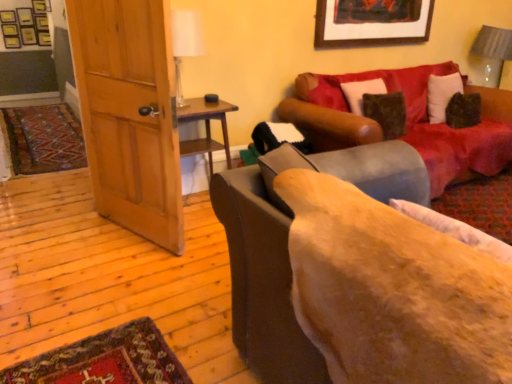
You are a GUI agent. You are given a task and a screenshot of the screen. Output one action in this format:
    pyautogui.click(x=<x>, y=<y>)
    Task: Click on the white glass table lamp at upper center
    
    Given the screenshot: What is the action you would take?
    pyautogui.click(x=185, y=43)

What do you see at coordinates (205, 127) in the screenshot?
I see `wooden side table at left` at bounding box center [205, 127].

Find the location of a particular element. This screenshot has height=384, width=512. wooden door at left is located at coordinates (129, 114).

The height and width of the screenshot is (384, 512). What do you see at coordinates (287, 246) in the screenshot?
I see `velvet brown couch at center, the first studio couch viewed from the front` at bounding box center [287, 246].

Find the location of a particular element. The height and width of the screenshot is (384, 512). wooden picture frame at upper center is located at coordinates tap(372, 22).

Is wooden side table at left aimed at velvet red couch at upper right, which is counted as the second studio couch, starting from the front?

No.

Does point (200, 100) lie behind point (452, 71)?

No, it is in front of (452, 71).

Is wooden side table at left to the right of velvet red couch at upper right, acting as the first studio couch starting from the back, from the viewer's perspective?

No, wooden side table at left is not to the right of velvet red couch at upper right, acting as the first studio couch starting from the back.

Is wooden side table at left far from velvet red couch at upper right, which is counted as the second studio couch, starting from the front?

Actually, wooden side table at left and velvet red couch at upper right, which is counted as the second studio couch, starting from the front, are a little close together.

Could you tell me if white glass table lamp at upper center is turned towards wooden side table at left?

No, white glass table lamp at upper center is not oriented towards wooden side table at left.

Considering the relative sizes of white glass table lamp at upper center and wooden side table at left in the image provided, is white glass table lamp at upper center bigger than wooden side table at left?

No, white glass table lamp at upper center is not bigger than wooden side table at left.

From a real-world perspective, is white glass table lamp at upper center over wooden side table at left?

Yes.

Can you confirm if white glass table lamp at upper center is thinner than wooden side table at left?

Yes, white glass table lamp at upper center is thinner than wooden side table at left.

Is white glass table lamp at upper center in front of velvet red couch at upper right, which is counted as the second studio couch, starting from the front?

Yes, it is in front of velvet red couch at upper right, which is counted as the second studio couch, starting from the front.

Considering the sizes of objects white glass table lamp at upper center and velvet red couch at upper right, which is counted as the second studio couch, starting from the front, in the image provided, who is wider, white glass table lamp at upper center or velvet red couch at upper right, which is counted as the second studio couch, starting from the front,?

With larger width is velvet red couch at upper right, which is counted as the second studio couch, starting from the front.

Looking at this image, considering the sizes of objects white glass table lamp at upper center and velvet red couch at upper right, which is counted as the second studio couch, starting from the front, in the image provided, who is bigger, white glass table lamp at upper center or velvet red couch at upper right, which is counted as the second studio couch, starting from the front,?

Bigger between the two is velvet red couch at upper right, which is counted as the second studio couch, starting from the front.

From a real-world perspective, is velvet red couch at upper right, acting as the first studio couch starting from the back, located higher than fluffy beige pillow at lower right?

No, from a real-world perspective, velvet red couch at upper right, acting as the first studio couch starting from the back, is not on top of fluffy beige pillow at lower right.

Where is `pillow to the left of velvet red couch at upper right, which is counted as the second studio couch, starting from the front`? pillow to the left of velvet red couch at upper right, which is counted as the second studio couch, starting from the front is located at coordinates (455, 229).

Can you tell me how much velvet red couch at upper right, which is counted as the second studio couch, starting from the front, and fluffy beige pillow at lower right differ in facing direction?

There is a 90.3-degree angle between the facing directions of velvet red couch at upper right, which is counted as the second studio couch, starting from the front, and fluffy beige pillow at lower right.

Can you confirm if velvet red couch at upper right, which is counted as the second studio couch, starting from the front, is positioned to the right of fluffy beige pillow at lower right?

Correct, you'll find velvet red couch at upper right, which is counted as the second studio couch, starting from the front, to the right of fluffy beige pillow at lower right.

Considering the sizes of objects wooden picture frame at upper center and gray fabric lampshade at upper right in the image provided, who is wider, wooden picture frame at upper center or gray fabric lampshade at upper right?

gray fabric lampshade at upper right.

From a real-world perspective, which object stands above the other?

wooden picture frame at upper center is physically above.

Can gray fabric lampshade at upper right be found inside wooden picture frame at upper center?

No, wooden picture frame at upper center does not contain gray fabric lampshade at upper right.

From the picture: Based on their positions, is wooden picture frame at upper center located to the left or right of gray fabric lampshade at upper right?

wooden picture frame at upper center is to the left of gray fabric lampshade at upper right.

Which of these two, fluffy beige pillow at lower right or wooden door at left, is wider?

wooden door at left is wider.

From their relative heights in the image, would you say fluffy beige pillow at lower right is taller or shorter than wooden door at left?

Considering their sizes, fluffy beige pillow at lower right has less height than wooden door at left.

Is fluffy beige pillow at lower right smaller than wooden door at left?

Correct, fluffy beige pillow at lower right occupies less space than wooden door at left.

From a real-world perspective, is fluffy beige pillow at lower right positioned above or below wooden door at left?

Clearly, from a real-world perspective, fluffy beige pillow at lower right is above wooden door at left.

Which is closer, (475, 146) or (211, 165)?

Point (475, 146) is positioned farther from the camera compared to point (211, 165).

In the scene shown: Could you tell me if velvet red couch at upper right, acting as the first studio couch starting from the back, is turned towards wooden side table at left?

No, velvet red couch at upper right, acting as the first studio couch starting from the back, is not oriented towards wooden side table at left.

Which of these two, velvet red couch at upper right, which is counted as the second studio couch, starting from the front, or wooden side table at left, is bigger?

velvet red couch at upper right, which is counted as the second studio couch, starting from the front.

From a real-world perspective, is velvet red couch at upper right, acting as the first studio couch starting from the back, positioned above or below wooden side table at left?

velvet red couch at upper right, acting as the first studio couch starting from the back, is situated higher than wooden side table at left in the real world.

Find the location of `the 2nd studio couch to the right when counting from the wooden side table at left`. the 2nd studio couch to the right when counting from the wooden side table at left is located at coordinates (407, 122).

Identify the location of table located behind the white glass table lamp at upper center. (205, 127).

Considering their positions, is velvet brown couch at center, the first studio couch viewed from the front, positioned further to wooden door at left than white glass table lamp at upper center?

Based on the image, velvet brown couch at center, the first studio couch viewed from the front, appears to be further to wooden door at left.

Considering their positions, is wooden door at left positioned further to fluffy beige pillow at lower right than velvet red couch at upper right, acting as the first studio couch starting from the back?

Based on the image, velvet red couch at upper right, acting as the first studio couch starting from the back, appears to be further to fluffy beige pillow at lower right.

When comparing their distances from wooden side table at left, does gray fabric lampshade at upper right or velvet red couch at upper right, acting as the first studio couch starting from the back, seem further?

The object further to wooden side table at left is gray fabric lampshade at upper right.

Considering their positions, is wooden picture frame at upper center positioned closer to velvet brown couch at center, the 2th studio couch viewed from the back, than wooden door at left?

wooden door at left.

When comparing their distances from wooden door at left, does wooden side table at left or gray fabric lampshade at upper right seem closer?

Based on the image, wooden side table at left appears to be nearer to wooden door at left.

Based on their spatial positions, is fluffy beige pillow at lower right or wooden door at left closer to velvet brown couch at center, the 2th studio couch viewed from the back?

fluffy beige pillow at lower right lies closer to velvet brown couch at center, the 2th studio couch viewed from the back, than the other object.

Which object lies further to the anchor point wooden door at left, velvet red couch at upper right, which is counted as the second studio couch, starting from the front, or wooden picture frame at upper center?

Based on the image, wooden picture frame at upper center appears to be further to wooden door at left.

From the image, which object appears to be farther from white glass table lamp at upper center, wooden side table at left or gray fabric lampshade at upper right?

Among the two, gray fabric lampshade at upper right is located further to white glass table lamp at upper center.

In order to click on pillow situated between white glass table lamp at upper center and gray fabric lampshade at upper right from left to right in this screenshot , I will do `click(455, 229)`.

Image resolution: width=512 pixels, height=384 pixels. I want to click on pillow between velvet brown couch at center, the first studio couch viewed from the front, and wooden side table at left in the front-back direction, so click(x=455, y=229).

I want to click on table between velvet brown couch at center, the first studio couch viewed from the front, and wooden picture frame at upper center from front to back, so click(205, 127).

At what (x,y) coordinates should I click in order to perform the action: click on pillow between white glass table lamp at upper center and velvet red couch at upper right, acting as the first studio couch starting from the back, in the horizontal direction. Please return your answer as a coordinate pair (x, y). The width and height of the screenshot is (512, 384). Looking at the image, I should click on (455, 229).